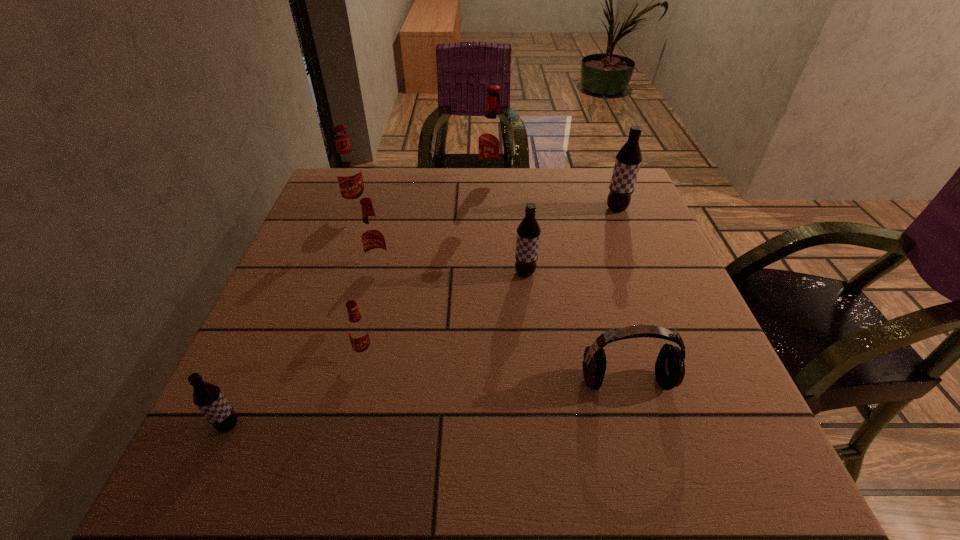
Find the location of a particular element. The width and height of the screenshot is (960, 540). free space at the near left corner is located at coordinates (264, 477).

The height and width of the screenshot is (540, 960). I want to click on free region at the far right corner of the desktop, so click(x=597, y=206).

The width and height of the screenshot is (960, 540). In order to click on free spot at the near right corner of the desktop in this screenshot , I will do `click(735, 471)`.

Identify the location of free space between the smallest red root beer and the leftmost root beer. This screenshot has height=540, width=960. (x=297, y=389).

You are a GUI agent. You are given a task and a screenshot of the screen. Output one action in this format:
    pyautogui.click(x=<x>, y=<y>)
    Task: Click on the empty location between the third biggest red root beer and the second brown root beer from right to left
    The height and width of the screenshot is (540, 960).
    Given the screenshot: What is the action you would take?
    pyautogui.click(x=452, y=270)

Image resolution: width=960 pixels, height=540 pixels. Identify the location of vacant area that lies between the headset and the second object from left to right. (492, 294).

Identify the location of free space between the second nearest root beer and the second object from left to right. (361, 280).

This screenshot has height=540, width=960. Find the location of `free area in between the third biggest red root beer and the nearest red root beer`. free area in between the third biggest red root beer and the nearest red root beer is located at coordinates (372, 310).

This screenshot has width=960, height=540. Identify the location of vacant space that is in between the farthest object and the second smallest brown root beer. (508, 227).

At what (x,y) coordinates should I click in order to perform the action: click on vacant point located between the second brown root beer from right to left and the sixth farthest object. Please return your answer as a coordinate pair (x, y). Image resolution: width=960 pixels, height=540 pixels. Looking at the image, I should click on [x=444, y=313].